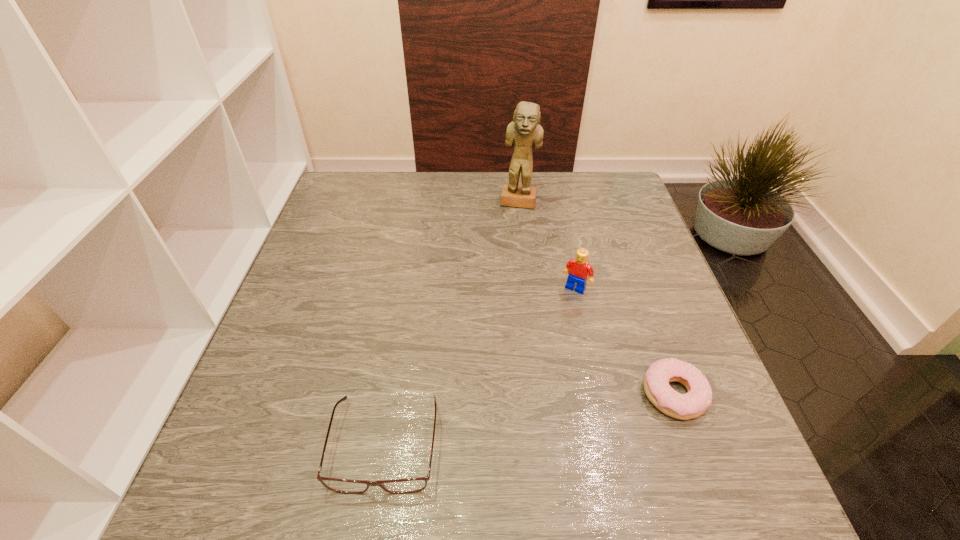
I want to click on free spot on the desktop that is between the spectacles and the doughnut and is positioned on the front-facing side of the Lego, so click(495, 425).

I want to click on free space on the desktop that is between the spectacles and the doughnut and is positioned on the front-facing side of the third object from right to left, so click(x=493, y=425).